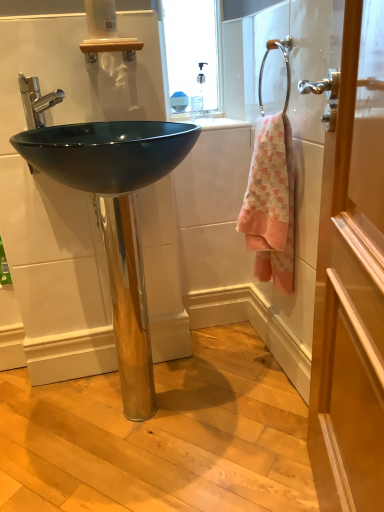
Question: Is chrome metallic towel ring at upper right not close to polished chrome faucet at upper left?

Choices:
 (A) no
 (B) yes

Answer: (A)

Question: Is chrome metallic towel ring at upper right completely or partially outside of polished chrome faucet at upper left?

Choices:
 (A) no
 (B) yes

Answer: (B)

Question: Can you confirm if chrome metallic towel ring at upper right is shorter than polished chrome faucet at upper left?

Choices:
 (A) no
 (B) yes

Answer: (A)

Question: Does chrome metallic towel ring at upper right have a greater height compared to polished chrome faucet at upper left?

Choices:
 (A) no
 (B) yes

Answer: (B)

Question: From the image's perspective, is chrome metallic towel ring at upper right on polished chrome faucet at upper left?

Choices:
 (A) yes
 (B) no

Answer: (A)

Question: Is chrome metallic towel ring at upper right facing towards polished chrome faucet at upper left?

Choices:
 (A) yes
 (B) no

Answer: (A)

Question: From a real-world perspective, is pink woven towel at right over glossy black sink at center?

Choices:
 (A) no
 (B) yes

Answer: (B)

Question: Does pink woven towel at right appear on the right side of glossy black sink at center?

Choices:
 (A) no
 (B) yes

Answer: (B)

Question: From a real-world perspective, does pink woven towel at right sit lower than glossy black sink at center?

Choices:
 (A) yes
 (B) no

Answer: (B)

Question: Can you confirm if pink woven towel at right is wider than glossy black sink at center?

Choices:
 (A) no
 (B) yes

Answer: (A)

Question: From the image's perspective, is pink woven towel at right over glossy black sink at center?

Choices:
 (A) no
 (B) yes

Answer: (B)

Question: Is pink woven towel at right thinner than glossy black sink at center?

Choices:
 (A) no
 (B) yes

Answer: (B)

Question: Does pink woven towel at right appear on the right side of chrome metallic towel ring at upper right?

Choices:
 (A) no
 (B) yes

Answer: (A)